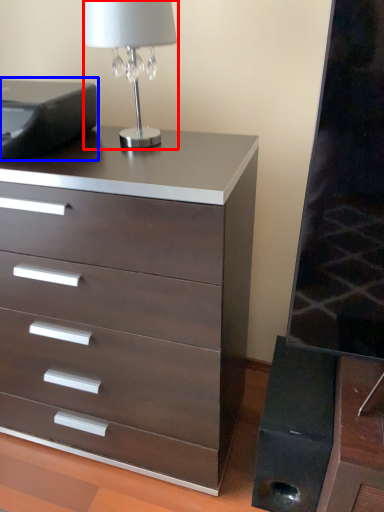
Question: Among these objects, which one is farthest to the camera, table lamp (highlighted by a red box) or printer (highlighted by a blue box)?

Choices:
 (A) table lamp
 (B) printer

Answer: (B)